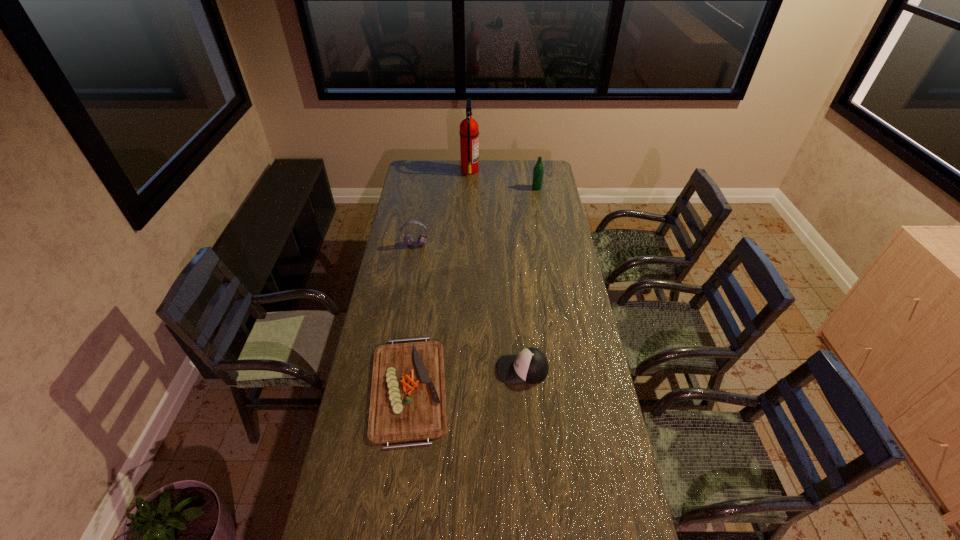
Identify the location of free space at the far edge of the desktop. The image size is (960, 540). (519, 179).

Where is `vacant space at the left edge of the desktop`? vacant space at the left edge of the desktop is located at coordinates click(x=408, y=300).

Where is `vacant position at the right edge of the desktop`? vacant position at the right edge of the desktop is located at coordinates (593, 362).

Identify the location of vacant area at the far left corner of the desktop. (423, 170).

Locate an element on the screen. This screenshot has width=960, height=540. free spot between the third shortest object and the farthest object is located at coordinates (443, 207).

This screenshot has height=540, width=960. Find the location of `vacant space in between the fourth nearest object and the shortest object`. vacant space in between the fourth nearest object and the shortest object is located at coordinates (472, 288).

The width and height of the screenshot is (960, 540). Find the location of `unoccupied position between the fourth shortest object and the farthest object`. unoccupied position between the fourth shortest object and the farthest object is located at coordinates (503, 179).

Locate an element on the screen. The width and height of the screenshot is (960, 540). vacant space in between the second farthest object and the cap is located at coordinates (530, 279).

Locate an element on the screen. vacant space that's between the second shortest object and the third shortest object is located at coordinates coord(469,307).

Locate an element on the screen. The image size is (960, 540). vacant area that lies between the third nearest object and the shortest object is located at coordinates (412, 316).